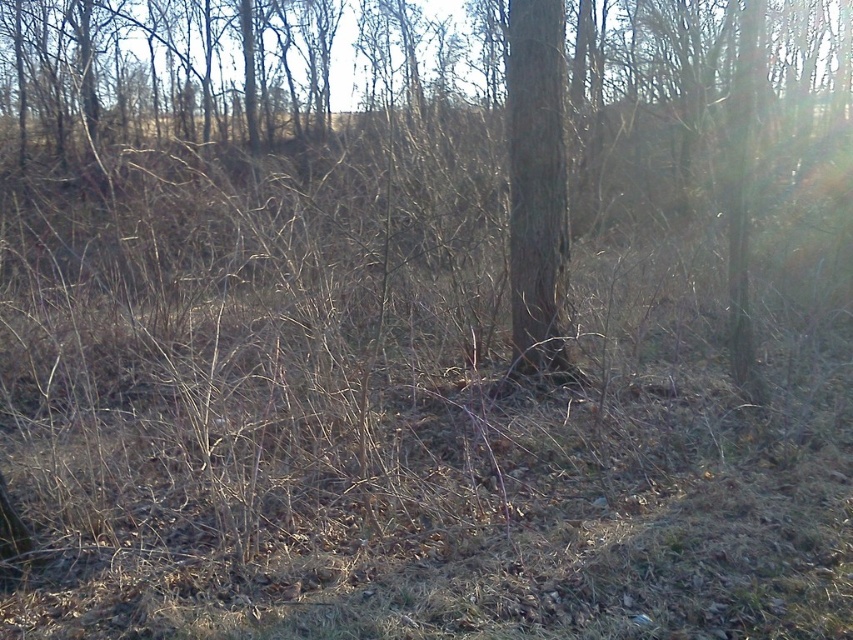
Is brown rough tree at center smaller than brown rough bark tree at center?

No.

Describe the element at coordinates (619, 104) in the screenshot. The width and height of the screenshot is (853, 640). I see `brown rough tree at center` at that location.

This screenshot has height=640, width=853. Describe the element at coordinates (619, 104) in the screenshot. I see `brown rough tree at center` at that location.

Image resolution: width=853 pixels, height=640 pixels. In order to click on brown rough tree at center in this screenshot , I will do `click(619, 104)`.